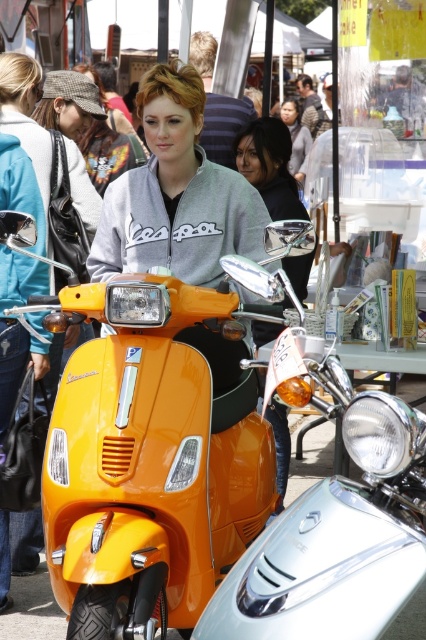
You are standing at the entrance of the market and see the point marked at coordinates (270, 166). What object is located at that point?

The point at coordinates (270, 166) indicates the matte orange scooter at center.

You are standing in the market and see both the matte orange scooter at center and the matte gray sweater at center. Which object is nearer to you?

The matte orange scooter at center is closer to the viewer than the matte gray sweater at center.

You are a delivery person who needs to pick up a package from a customer. The customer is wearing a matte gray sweater at center and is standing near a matte orange scooter at center. Can you reach the customer without moving more than 7 meters?

The distance between the matte orange scooter at center and the matte gray sweater at center is 6.92 meters, so yes, you can reach the customer without moving more than 7 meters.